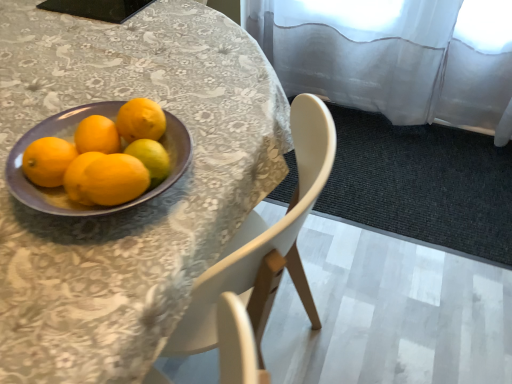
Question: From a real-world perspective, is purple glossy bowl at left positioned above or below yellow matte lemon at center?

Choices:
 (A) below
 (B) above

Answer: (A)

Question: In the image, is purple glossy bowl at left on the left side or the right side of yellow matte lemon at center?

Choices:
 (A) right
 (B) left

Answer: (B)

Question: Which is farther from the matte yellow orange at left?

Choices:
 (A) purple glossy bowl at left
 (B) yellow matte lemon at center
 (C) purple plate at upper left

Answer: (C)

Question: Which is farther from the purple plate at upper left?

Choices:
 (A) purple glossy bowl at left
 (B) yellow matte lemon at center
 (C) matte yellow orange at left

Answer: (C)